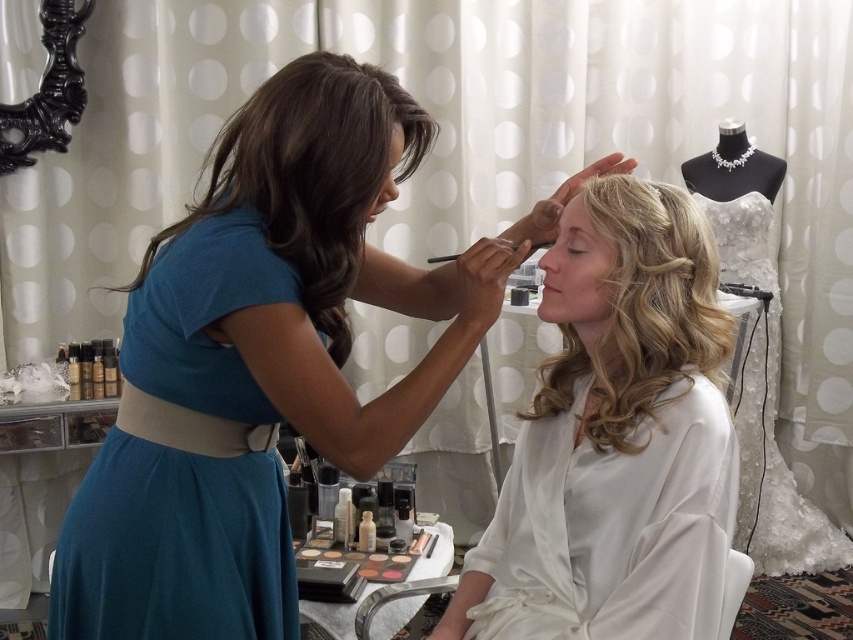
You are a photographer positioned at the center of the room. You want to take a photo of the two points mentioned in the scene. Which point, point (x=173, y=433) or point (x=355, y=259), will appear larger in the photo?

Point (x=173, y=433) will appear larger in the photo because it is closer to the viewer than point (x=355, y=259).

You are a stylist preparing for a client who needs to choose between two dresses for an event. The client wants to know which dress is wider. The dresses available are the teal satin dress at upper left and the white lace dress at right. Can you tell them which one is wider?

The teal satin dress at upper left is wider than the white lace dress at right according to the description provided.